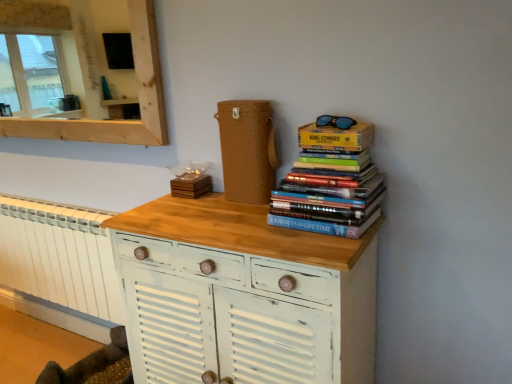
What do you see at coordinates (94, 69) in the screenshot?
I see `wooden mirror at upper left` at bounding box center [94, 69].

What is the approximate height of yellow cardboard box at upper right, which is counted as the 1th paperback book, starting from the front?

3.13 inches.

Identify the location of yellow cardboard box at upper right, which ranks as the 1th paperback book in right-to-left order. (336, 137).

The width and height of the screenshot is (512, 384). Identify the location of wooden coaster at center, which is the second paperback book from right to left. (191, 187).

Measure the distance between white distressed wood chest of drawers at center and camera.

1.10 meters.

Find the location of a particular element. The height and width of the screenshot is (384, 512). wooden mirror at upper left is located at coordinates (94, 69).

Is yellow cardboard box at upper right, positioned as the 2th paperback book in left-to-right order, situated inside hardcover books at upper right or outside?

The correct answer is: outside.

Between point (355, 135) and point (362, 214), which one is positioned in front?

The point (362, 214) is closer.

Would you consider yellow cardboard box at upper right, arranged as the 2th paperback book when viewed from the back, to be distant from hardcover books at upper right?

No, yellow cardboard box at upper right, arranged as the 2th paperback book when viewed from the back, is in close proximity to hardcover books at upper right.

Looking at this image, considering the sizes of objects yellow cardboard box at upper right, the second paperback book positioned from the bottom, and hardcover books at upper right in the image provided, who is bigger, yellow cardboard box at upper right, the second paperback book positioned from the bottom, or hardcover books at upper right?

With larger size is hardcover books at upper right.

How many degrees apart are the facing directions of yellow cardboard box at upper right, which is counted as the 1th paperback book, starting from the front, and wooden mirror at upper left?

The facing directions of yellow cardboard box at upper right, which is counted as the 1th paperback book, starting from the front, and wooden mirror at upper left are 2.44 degrees apart.

In the scene shown: Between yellow cardboard box at upper right, the second paperback book positioned from the bottom, and wooden mirror at upper left, which one has smaller width?

wooden mirror at upper left.

Between yellow cardboard box at upper right, which is counted as the 1th paperback book, starting from the front, and wooden mirror at upper left, which one is positioned in front?

yellow cardboard box at upper right, which is counted as the 1th paperback book, starting from the front, is closer to the camera.

Does yellow cardboard box at upper right, which ranks as the 1th paperback book in right-to-left order, have a lesser height compared to wooden mirror at upper left?

Yes.

Can you confirm if white distressed wood chest of drawers at center is taller than wooden coaster at center, acting as the 1th paperback book starting from the back?

Yes, white distressed wood chest of drawers at center is taller than wooden coaster at center, acting as the 1th paperback book starting from the back.

Consider the image. Does white distressed wood chest of drawers at center appear on the right side of wooden coaster at center, the 1th paperback book ordered from the bottom?

Correct, you'll find white distressed wood chest of drawers at center to the right of wooden coaster at center, the 1th paperback book ordered from the bottom.

Is point (250, 364) closer to viewer compared to point (201, 187)?

Yes, point (250, 364) is closer to viewer.

From a real-world perspective, is white distressed wood chest of drawers at center positioned above or below wooden coaster at center, arranged as the 2th paperback book when viewed from the top?

white distressed wood chest of drawers at center is situated lower than wooden coaster at center, arranged as the 2th paperback book when viewed from the top, in the real world.

Which of these two, wooden mirror at upper left or wooden coaster at center, which is the second paperback book from right to left, is wider?

With larger width is wooden mirror at upper left.

From the image's perspective, would you say wooden mirror at upper left is positioned over wooden coaster at center, arranged as the 2th paperback book when viewed from the top?

Yes, from the image's perspective, wooden mirror at upper left is on top of wooden coaster at center, arranged as the 2th paperback book when viewed from the top.

From a real-world perspective, is wooden mirror at upper left above or below wooden coaster at center, positioned as the first paperback book in left-to-right order?

From a real-world perspective, wooden mirror at upper left is physically above wooden coaster at center, positioned as the first paperback book in left-to-right order.

Which object is positioned more to the left, wooden mirror at upper left or wooden coaster at center, acting as the second paperback book starting from the front?

Positioned to the left is wooden mirror at upper left.

Locate an element on the screen. The height and width of the screenshot is (384, 512). paperback book that is on the right side of white distressed wood chest of drawers at center is located at coordinates (336, 137).

Considering the positions of point (188, 259) and point (362, 122), is point (188, 259) closer or farther from the camera than point (362, 122)?

Point (188, 259) is positioned farther from the camera compared to point (362, 122).

In the image, is white distressed wood chest of drawers at center positioned in front of or behind yellow cardboard box at upper right, which is counted as the 1th paperback book, starting from the front?

Visually, white distressed wood chest of drawers at center is located in front of yellow cardboard box at upper right, which is counted as the 1th paperback book, starting from the front.

Is white distressed wood chest of drawers at center facing away from yellow cardboard box at upper right, which ranks as the 1th paperback book in right-to-left order?

white distressed wood chest of drawers at center does not have its back to yellow cardboard box at upper right, which ranks as the 1th paperback book in right-to-left order.

How different are the orientations of white painted radiator at lower left and white distressed wood chest of drawers at center in degrees?

white painted radiator at lower left and white distressed wood chest of drawers at center are facing 1.3 degrees away from each other.

Which of these two, white painted radiator at lower left or white distressed wood chest of drawers at center, stands shorter?

white painted radiator at lower left is shorter.

In the scene shown: From a real-world perspective, which object rests below the other?

A: From a 3D spatial view, white distressed wood chest of drawers at center is below.

In the image, is white painted radiator at lower left positioned in front of or behind white distressed wood chest of drawers at center?

Visually, white painted radiator at lower left is located behind white distressed wood chest of drawers at center.

Considering the relative positions of wooden mirror at upper left and blue reflective lenses at upper right in the image provided, is wooden mirror at upper left to the right of blue reflective lenses at upper right from the viewer's perspective?

No.

In the image, is wooden mirror at upper left positioned in front of or behind blue reflective lenses at upper right?

In the image, wooden mirror at upper left appears behind blue reflective lenses at upper right.

Is blue reflective lenses at upper right at the back of wooden mirror at upper left?

No.

Considering the relative sizes of wooden mirror at upper left and blue reflective lenses at upper right in the image provided, is wooden mirror at upper left bigger than blue reflective lenses at upper right?

Correct, wooden mirror at upper left is larger in size than blue reflective lenses at upper right.

I want to click on paperback book above the hardcover books at upper right (from a real-world perspective), so (x=336, y=137).

Image resolution: width=512 pixels, height=384 pixels. Find the location of `medicine cabinet that appears behind the yellow cardboard box at upper right, which is counted as the 1th paperback book, starting from the front`. medicine cabinet that appears behind the yellow cardboard box at upper right, which is counted as the 1th paperback book, starting from the front is located at coordinates pyautogui.click(x=94, y=69).

From the picture: From the image, which object appears to be farther from yellow cardboard box at upper right, which is counted as the 1th paperback book, starting from the front, white painted radiator at lower left or blue reflective lenses at upper right?

Among the two, white painted radiator at lower left is located further to yellow cardboard box at upper right, which is counted as the 1th paperback book, starting from the front.

Estimate the real-world distances between objects in this image. Which object is closer to hardcover books at upper right, white distressed wood chest of drawers at center or blue reflective lenses at upper right?

blue reflective lenses at upper right lies closer to hardcover books at upper right than the other object.

Looking at this image, which object lies nearer to the anchor point wooden mirror at upper left, hardcover books at upper right or white distressed wood chest of drawers at center?

Based on the image, white distressed wood chest of drawers at center appears to be nearer to wooden mirror at upper left.

Considering their positions, is yellow cardboard box at upper right, arranged as the 2th paperback book when viewed from the back, positioned further to blue reflective lenses at upper right than white distressed wood chest of drawers at center?

Based on the image, white distressed wood chest of drawers at center appears to be further to blue reflective lenses at upper right.

From the picture: Based on their spatial positions, is wooden mirror at upper left or white painted radiator at lower left further from wooden coaster at center, arranged as the 2th paperback book when viewed from the top?

wooden mirror at upper left lies further to wooden coaster at center, arranged as the 2th paperback book when viewed from the top, than the other object.

From the image, which object appears to be nearer to wooden mirror at upper left, wooden coaster at center, acting as the second paperback book starting from the front, or blue reflective lenses at upper right?

Based on the image, wooden coaster at center, acting as the second paperback book starting from the front, appears to be nearer to wooden mirror at upper left.

Estimate the real-world distances between objects in this image. Which object is closer to yellow cardboard box at upper right, acting as the 1th paperback book starting from the top, hardcover books at upper right or white painted radiator at lower left?

Among the two, hardcover books at upper right is located nearer to yellow cardboard box at upper right, acting as the 1th paperback book starting from the top.

Estimate the real-world distances between objects in this image. Which object is closer to blue reflective lenses at upper right, white distressed wood chest of drawers at center or white painted radiator at lower left?

Based on the image, white distressed wood chest of drawers at center appears to be nearer to blue reflective lenses at upper right.

The image size is (512, 384). Find the location of `book that lies between blue reflective lenses at upper right and white distressed wood chest of drawers at center from top to bottom`. book that lies between blue reflective lenses at upper right and white distressed wood chest of drawers at center from top to bottom is located at coordinates (330, 183).

You are a GUI agent. You are given a task and a screenshot of the screen. Output one action in this format:
    pyautogui.click(x=<x>, y=<y>)
    Task: Click on the chest of drawers between wooden mirror at upper left and blue reflective lenses at upper right from left to right
    The height and width of the screenshot is (384, 512).
    Given the screenshot: What is the action you would take?
    pyautogui.click(x=243, y=295)

Where is `the chest of drawers located between white painted radiator at lower left and yellow cardboard box at upper right, which ranks as the 1th paperback book in right-to-left order, in the left-right direction`? the chest of drawers located between white painted radiator at lower left and yellow cardboard box at upper right, which ranks as the 1th paperback book in right-to-left order, in the left-right direction is located at coordinates (243, 295).

I want to click on book located between wooden mirror at upper left and yellow cardboard box at upper right, positioned as the 2th paperback book in left-to-right order, in the left-right direction, so click(x=330, y=183).